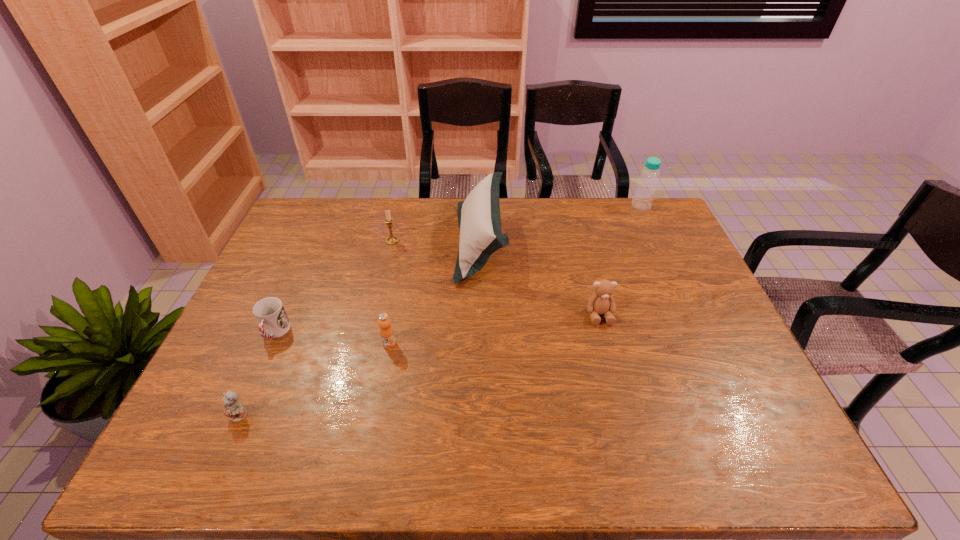
Identify the location of the rightmost object. The width and height of the screenshot is (960, 540). (642, 200).

The width and height of the screenshot is (960, 540). I want to click on cushion, so click(479, 219).

Image resolution: width=960 pixels, height=540 pixels. I want to click on the third object from left to right, so click(x=391, y=240).

Image resolution: width=960 pixels, height=540 pixels. Find the location of `the right teddy bear`. the right teddy bear is located at coordinates pos(601,302).

In order to click on the second object from right to left in this screenshot , I will do `click(601, 302)`.

At what (x,y) coordinates should I click in order to perform the action: click on the fourth object from right to left. Please return your answer as a coordinate pair (x, y). Image resolution: width=960 pixels, height=540 pixels. Looking at the image, I should click on (386, 331).

I want to click on cup, so click(273, 322).

What are the coordinates of `the nearest object` in the screenshot? It's located at (234, 410).

At what (x,y) coordinates should I click in order to perform the action: click on the left teddy bear. Please return your answer as a coordinate pair (x, y). Image resolution: width=960 pixels, height=540 pixels. Looking at the image, I should click on (234, 410).

I want to click on free region located on the left of the bottle, so click(x=583, y=205).